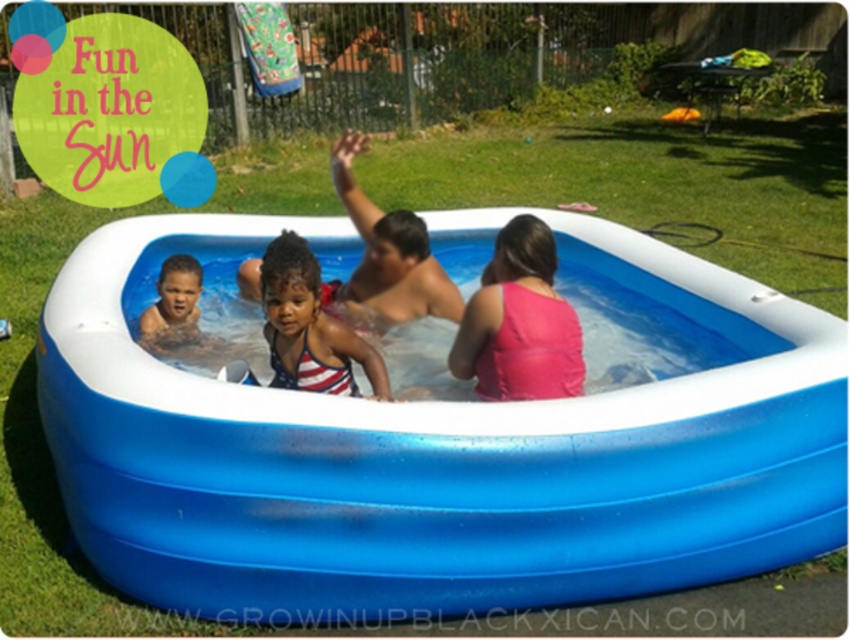
Between blue rubber pool at center and matte black baby at center, which one appears on the right side from the viewer's perspective?

Positioned to the right is blue rubber pool at center.

Is point (174, 381) farther from viewer compared to point (165, 276)?

No, (174, 381) is in front of (165, 276).

Locate an element on the screen. The height and width of the screenshot is (640, 850). blue rubber pool at center is located at coordinates (439, 448).

Does blue rubber pool at center appear on the right side of pink fabric swimsuit at center?

No, blue rubber pool at center is not to the right of pink fabric swimsuit at center.

Consider the image. Between blue rubber pool at center and pink fabric swimsuit at center, which one is positioned lower?

pink fabric swimsuit at center

Identify the location of blue rubber pool at center. This screenshot has height=640, width=850. (439, 448).

Find the location of `blue rubber pool at center`. blue rubber pool at center is located at coordinates (439, 448).

Is pink fabric swimsuit at center shorter than american flag swimsuit at center?

No.

Does pink fabric swimsuit at center have a smaller size compared to american flag swimsuit at center?

No.

At what (x,y) coordinates should I click in order to perform the action: click on pink fabric swimsuit at center. Please return your answer as a coordinate pair (x, y). This screenshot has height=640, width=850. Looking at the image, I should click on (519, 323).